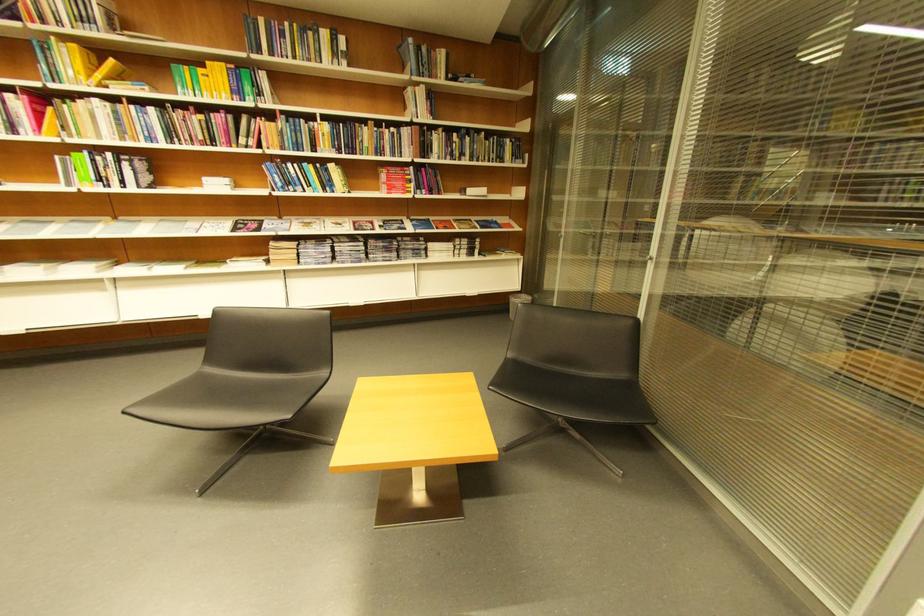
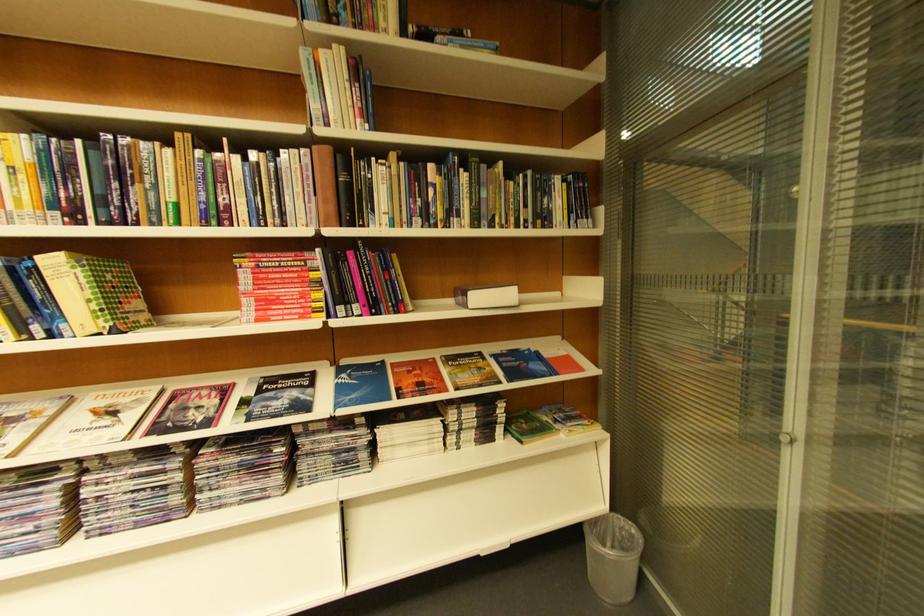
Where in the second image is the point corresponding to point 434,193 from the first image?

(367, 310)